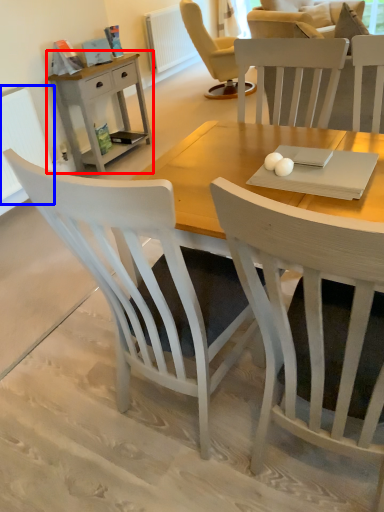
Question: Which point is further to the camera, nightstand (highlighted by a red box) or radiator (highlighted by a blue box)?

Choices:
 (A) nightstand
 (B) radiator

Answer: (A)